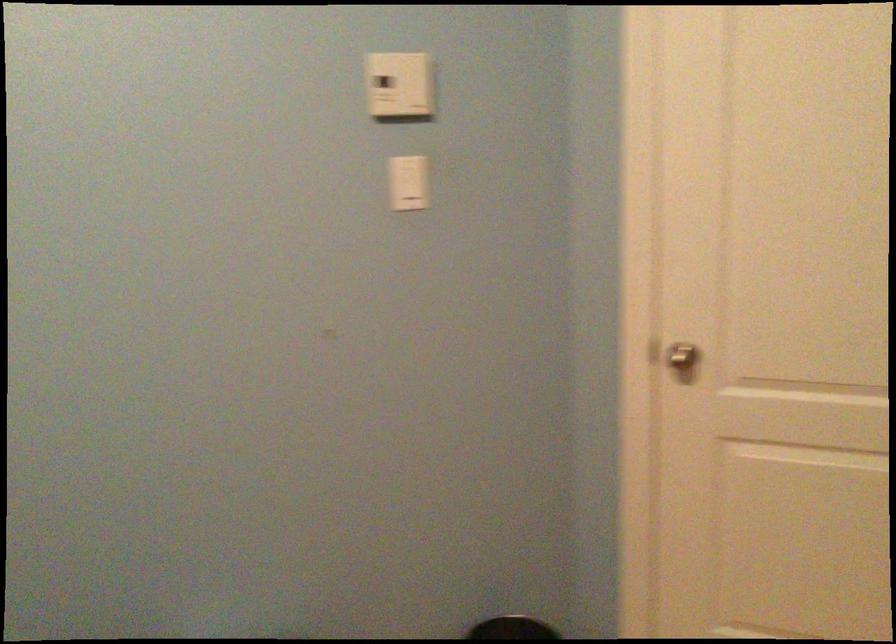
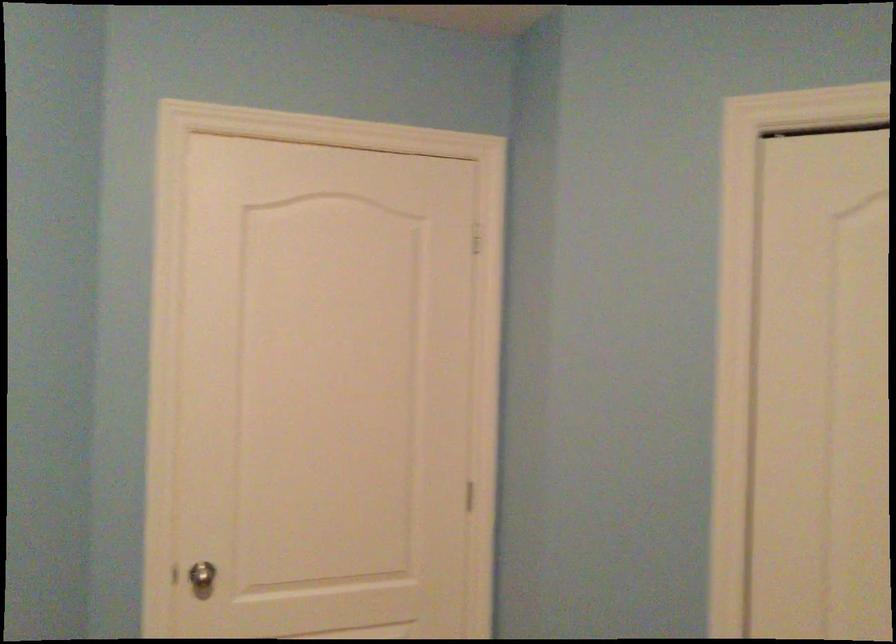
The point at (679, 366) is marked in the first image. Where is the corresponding point in the second image?

(202, 578)